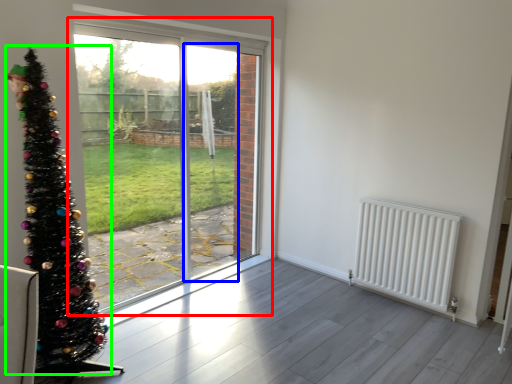
Question: Estimate the real-world distances between objects in this image. Which object is closer to window (highlighted by a red box), screen door (highlighted by a blue box) or christmas tree (highlighted by a green box)?

Choices:
 (A) screen door
 (B) christmas tree

Answer: (A)